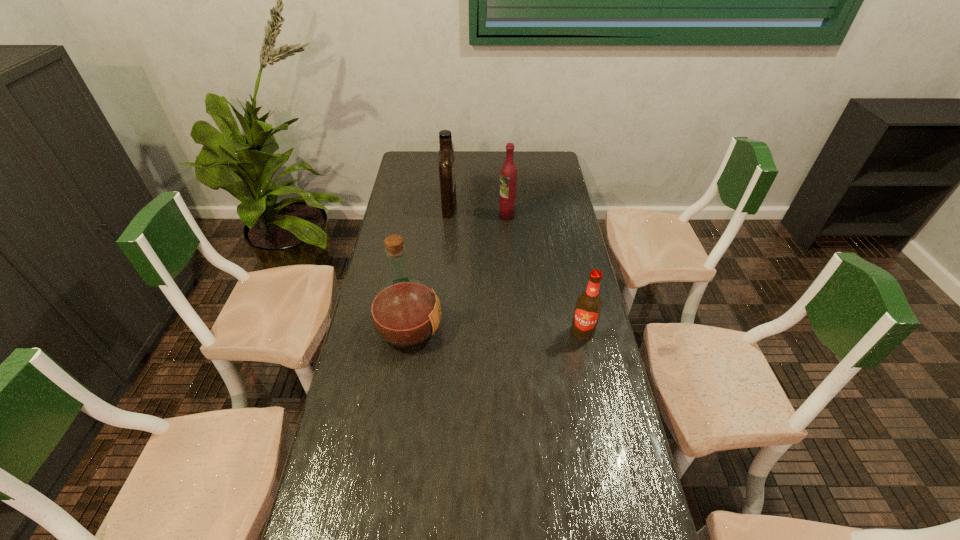
Locate which object is the second closest to the rightmost liquor. Please provide its 2D coordinates. Your answer should be formatted as a tuple, i.e. [(x, y)], where the tuple contains the x and y coordinates of a point satisfying the conditions above.

[(405, 312)]

Locate which liquor is the second closest to the shortest object. Please provide its 2D coordinates. Your answer should be formatted as a tuple, i.e. [(x, y)], where the tuple contains the x and y coordinates of a point satisfying the conditions above.

[(508, 176)]

Identify which liquor is located as the second nearest to the nearest liquor. Please provide its 2D coordinates. Your answer should be formatted as a tuple, i.e. [(x, y)], where the tuple contains the x and y coordinates of a point satisfying the conditions above.

[(508, 176)]

Where is `vacant position in the image that satisfies the following two spatial constraints: 1. on the label of the shortest object; 2. on the left side of the rightmost liquor`? vacant position in the image that satisfies the following two spatial constraints: 1. on the label of the shortest object; 2. on the left side of the rightmost liquor is located at coordinates (516, 333).

Identify the location of free space that satisfies the following two spatial constraints: 1. on the label of the rightmost object; 2. on the right side of the rightmost liquor. This screenshot has height=540, width=960. (516, 333).